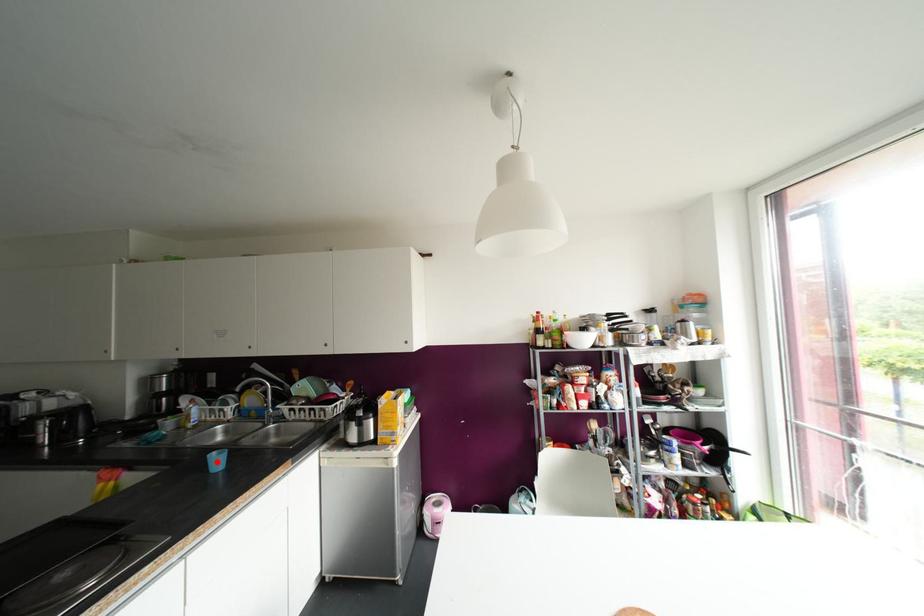
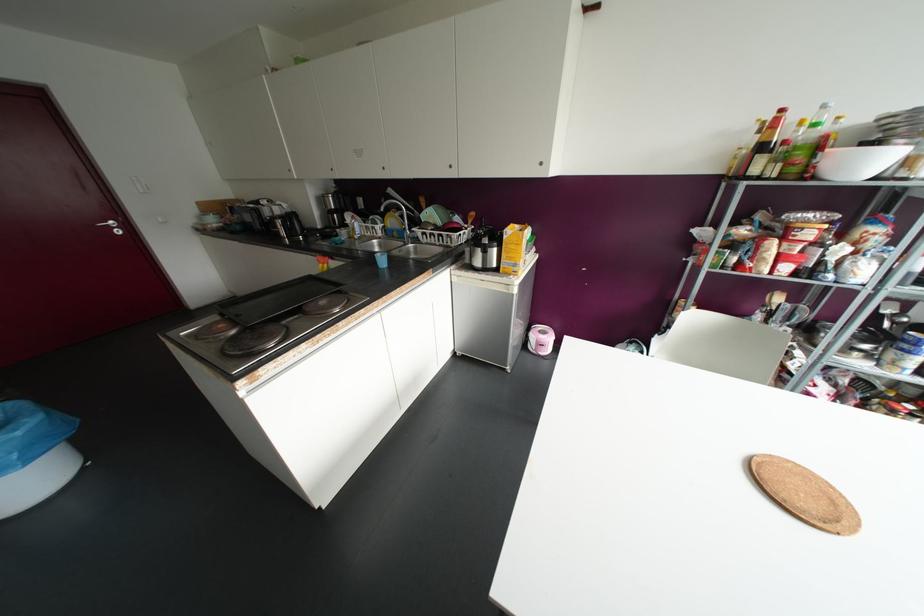
In the second image, find the point that corresponds to the highlighted location in the first image.

(382, 261)